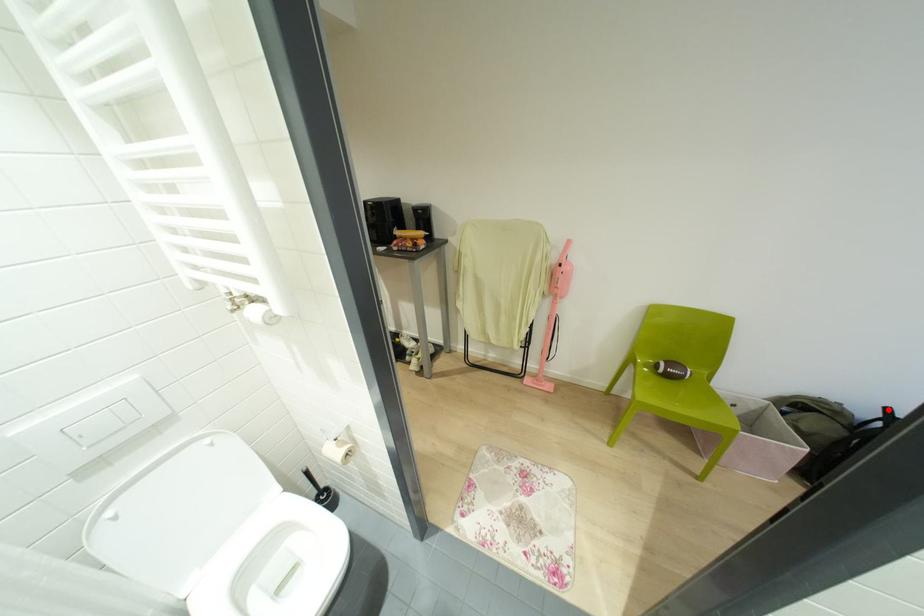
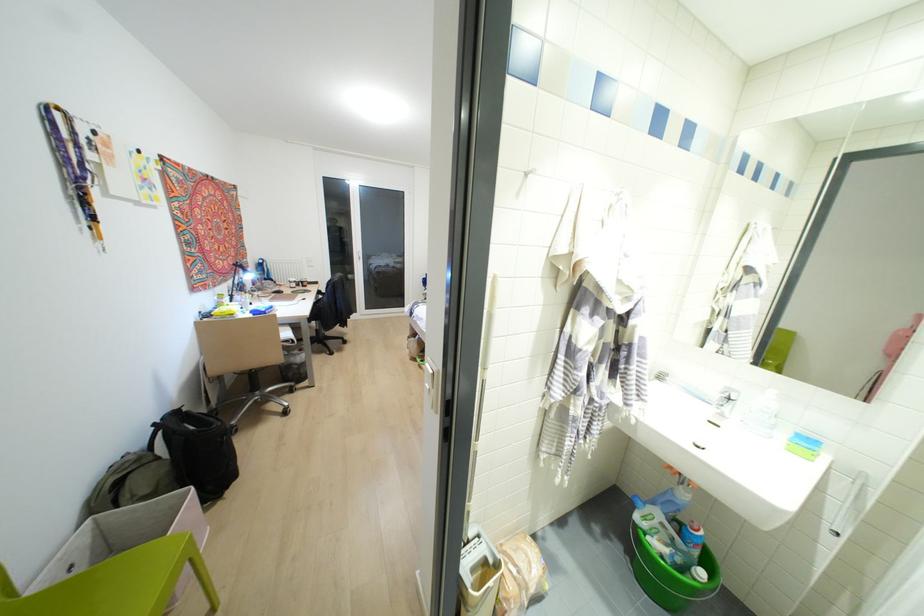
Question: I am providing you with two images of the same scene from different viewpoints. Image1 has a red point marked. In image2, the corresponding 3D location appears at what relative position? Reply with the corresponding letter.

Choices:
 (A) Closer
 (B) Farther

Answer: (A)